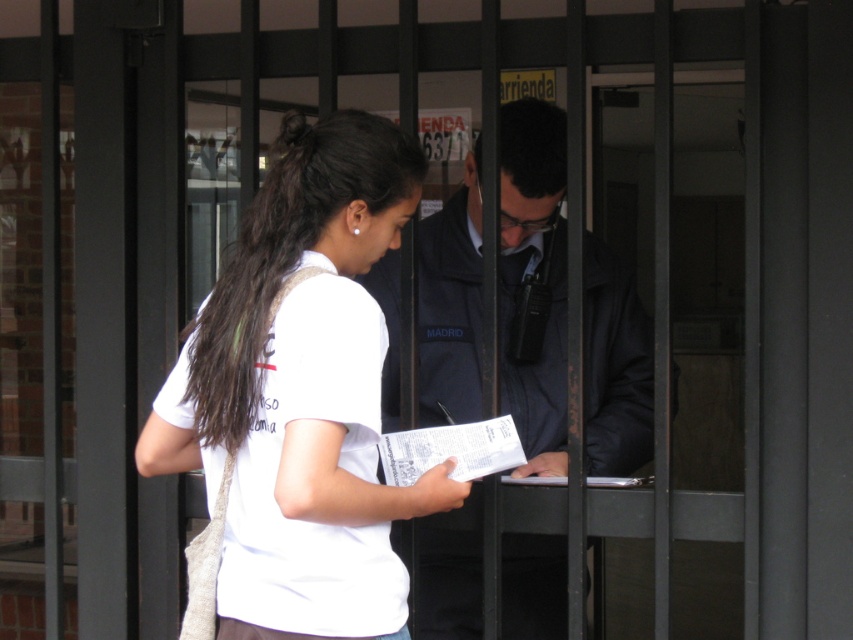
You are standing at the security checkpoint and see two points marked in the image. The first point is at coordinate point (395, 278) and the second is at point (291, 257). Which point is closer to you?

Point (291, 257) is closer to you because it is less further than point (395, 278).

You are a person who needs to maintain a social distance of at least 6 feet from others. You are currently standing at the point marked by the coordinate point at point [180,465]. Is the distance between you and the security guard in the image sufficient to maintain social distancing?

The distance between you and the security guard is 6.52 feet, which is slightly more than the required 6 feet. Therefore, the distance is sufficient to maintain social distancing.

You are a drone operator trying to locate the white matte shirt at center in the image. According to the coordinates provided, where would you direct the drone to focus?

The white matte shirt at center is located at coordinates point (302,394).